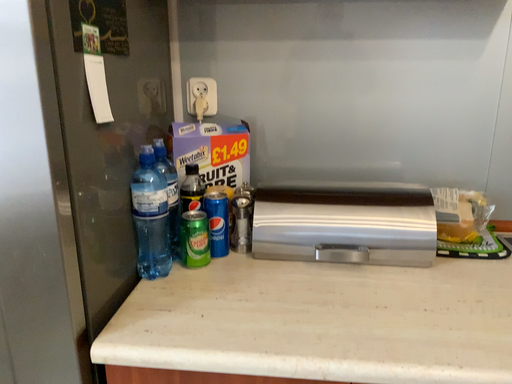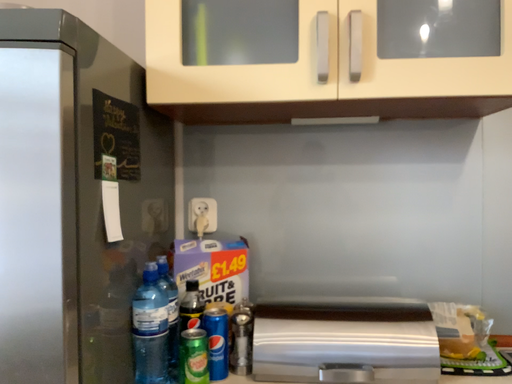
Question: How did the camera likely rotate when shooting the video?

Choices:
 (A) rotated downward
 (B) rotated upward

Answer: (B)